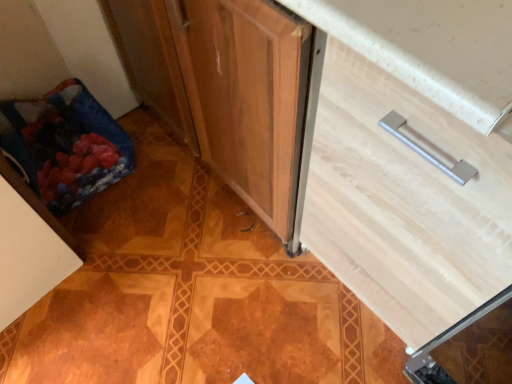
Question: Is light wood drawer at center behind white matte cabinet at lower left?

Choices:
 (A) no
 (B) yes

Answer: (A)

Question: Does light wood drawer at center touch white matte cabinet at lower left?

Choices:
 (A) no
 (B) yes

Answer: (A)

Question: Can you confirm if light wood drawer at center is positioned to the right of white matte cabinet at lower left?

Choices:
 (A) yes
 (B) no

Answer: (A)

Question: Is light wood drawer at center facing towards white matte cabinet at lower left?

Choices:
 (A) yes
 (B) no

Answer: (B)

Question: Can you confirm if light wood drawer at center is taller than white matte cabinet at lower left?

Choices:
 (A) yes
 (B) no

Answer: (A)

Question: Is light wood drawer at center to the left or to the right of white matte cabinet at lower left in the image?

Choices:
 (A) right
 (B) left

Answer: (A)

Question: Is light wood drawer at center taller or shorter than white matte cabinet at lower left?

Choices:
 (A) tall
 (B) short

Answer: (A)

Question: In terms of width, does light wood drawer at center look wider or thinner when compared to white matte cabinet at lower left?

Choices:
 (A) thin
 (B) wide

Answer: (B)

Question: Considering the positions of point (457, 256) and point (4, 248), is point (457, 256) closer or farther from the camera than point (4, 248)?

Choices:
 (A) farther
 (B) closer

Answer: (B)

Question: From a real-world perspective, is white matte cabinet at lower left above or below blue fabric bag at lower left?

Choices:
 (A) above
 (B) below

Answer: (A)

Question: Is point (40, 281) positioned closer to the camera than point (75, 94)?

Choices:
 (A) closer
 (B) farther

Answer: (A)

Question: In terms of height, does white matte cabinet at lower left look taller or shorter compared to blue fabric bag at lower left?

Choices:
 (A) tall
 (B) short

Answer: (A)

Question: Looking at their shapes, would you say white matte cabinet at lower left is wider or thinner than blue fabric bag at lower left?

Choices:
 (A) thin
 (B) wide

Answer: (B)

Question: Is blue fabric bag at lower left spatially inside light wood drawer at center, or outside of it?

Choices:
 (A) outside
 (B) inside

Answer: (A)

Question: Looking at their shapes, would you say blue fabric bag at lower left is wider or thinner than light wood drawer at center?

Choices:
 (A) wide
 (B) thin

Answer: (B)